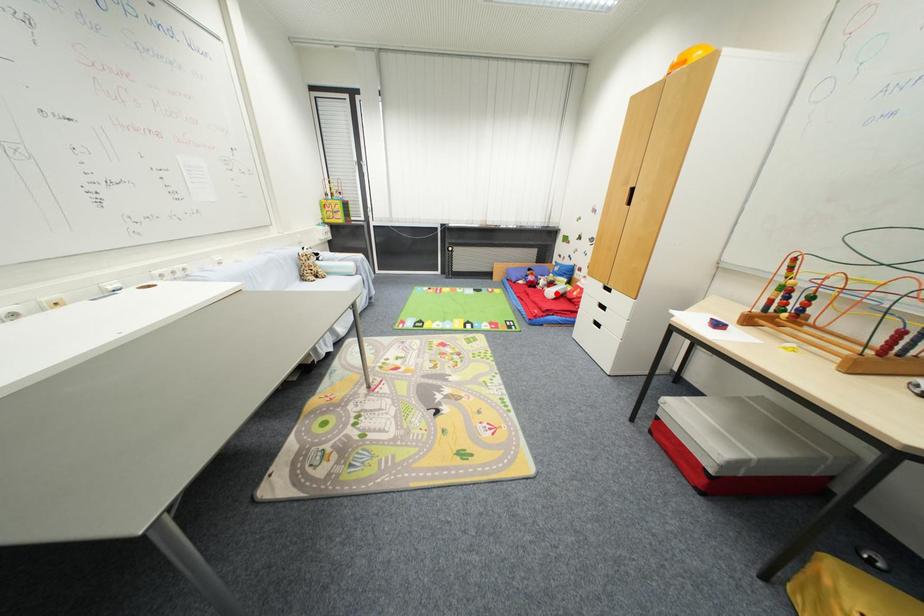
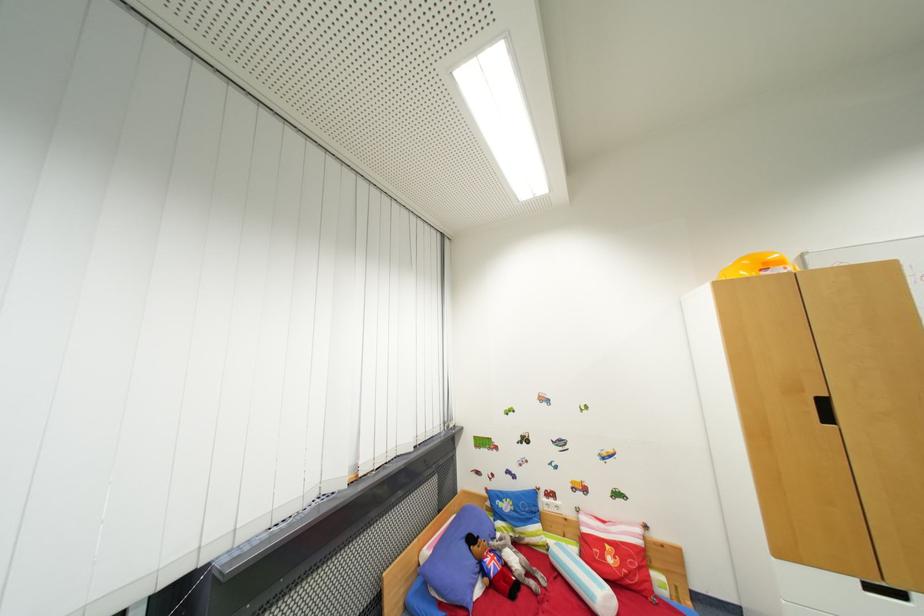
Question: I am providing you with two images of the same scene from different viewpoints. A red point is shown in image1. For the corresponding object point in image2, is it positioned nearer or farther from the camera?

Choices:
 (A) Nearer
 (B) Farther

Answer: (B)